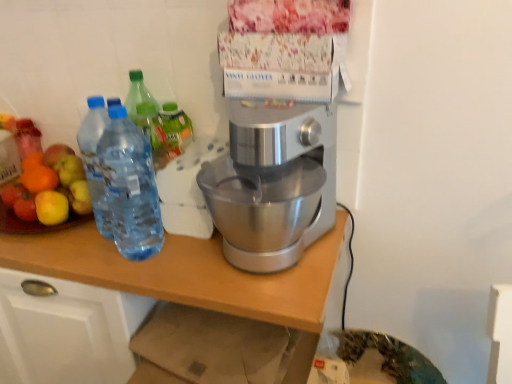
This screenshot has height=384, width=512. What do you see at coordinates (130, 187) in the screenshot?
I see `transparent plastic bottles at left` at bounding box center [130, 187].

Describe the element at coordinates (49, 187) in the screenshot. I see `shiny plastic fruit salad at left` at that location.

What is the approximate width of silver metallic table at center?

The width of silver metallic table at center is 21.30 inches.

Identify the location of transparent plastic bottles at left. The image size is (512, 384). (130, 187).

Does point (63, 191) appear closer or farther from the camera than point (136, 243)?

Clearly, point (63, 191) is more distant from the camera than point (136, 243).

Based on their positions, is shiny plastic fruit salad at left located to the left or right of transparent plastic bottles at left?

shiny plastic fruit salad at left is positioned on transparent plastic bottles at left's left side.

In the image, is shiny plastic fruit salad at left positioned in front of or behind transparent plastic bottles at left?

In the image, shiny plastic fruit salad at left appears behind transparent plastic bottles at left.

Can you confirm if shiny plastic fruit salad at left is taller than silver metallic table at center?

In fact, shiny plastic fruit salad at left may be shorter than silver metallic table at center.

Between shiny plastic fruit salad at left and silver metallic table at center, which one is positioned behind?

shiny plastic fruit salad at left.

Could you tell me if shiny plastic fruit salad at left is turned towards silver metallic table at center?

No, shiny plastic fruit salad at left does not turn towards silver metallic table at center.

Consider the image. Is transparent plastic bottles at left at the back of silver metallic stand mixer at center?

No, silver metallic stand mixer at center's orientation is not away from transparent plastic bottles at left.

Is silver metallic stand mixer at center bigger than transparent plastic bottles at left?

Yes, silver metallic stand mixer at center is bigger than transparent plastic bottles at left.

Considering the relative sizes of silver metallic stand mixer at center and transparent plastic bottles at left in the image provided, is silver metallic stand mixer at center shorter than transparent plastic bottles at left?

Yes, silver metallic stand mixer at center is shorter than transparent plastic bottles at left.

From a real-world perspective, is silver metallic stand mixer at center on top of transparent plastic bottles at left?

No, from a real-world perspective, silver metallic stand mixer at center is not above transparent plastic bottles at left.

Is silver metallic table at center positioned with its back to transparent plastic bottles at left?

No.

Looking at this image, considering the sizes of objects silver metallic table at center and transparent plastic bottles at left in the image provided, who is shorter, silver metallic table at center or transparent plastic bottles at left?

With less height is transparent plastic bottles at left.

How many degrees apart are the facing directions of silver metallic table at center and transparent plastic bottles at left?

There is a 0.347-degree angle between the facing directions of silver metallic table at center and transparent plastic bottles at left.

Is silver metallic table at center to the left or to the right of transparent plastic bottles at left in the image?

In the image, silver metallic table at center appears on the left side of transparent plastic bottles at left.

Considering the relative sizes of transparent plastic bottles at left and silver metallic stand mixer at center in the image provided, is transparent plastic bottles at left smaller than silver metallic stand mixer at center?

Indeed, transparent plastic bottles at left has a smaller size compared to silver metallic stand mixer at center.

Is transparent plastic bottles at left oriented away from silver metallic stand mixer at center?

No.

Is transparent plastic bottles at left positioned far away from silver metallic stand mixer at center?

That's not correct — transparent plastic bottles at left is a little close to silver metallic stand mixer at center.

Which is more to the right, transparent plastic bottles at left or silver metallic stand mixer at center?

silver metallic stand mixer at center.

From the image's perspective, does transparent plastic bottles at left appear lower than shiny plastic fruit salad at left?

Indeed, from the image's perspective, transparent plastic bottles at left is shown beneath shiny plastic fruit salad at left.

Is point (111, 112) closer or farther from the camera than point (46, 185)?

Clearly, point (111, 112) is closer to the camera than point (46, 185).

Would you say transparent plastic bottles at left is to the left or to the right of shiny plastic fruit salad at left in the picture?

Clearly, transparent plastic bottles at left is on the right of shiny plastic fruit salad at left in the image.

From a real-world perspective, which is physically below, transparent plastic bottles at left or shiny plastic fruit salad at left?

shiny plastic fruit salad at left.

At what (x,y) coordinates should I click in order to perform the action: click on coffee maker in front of the silver metallic table at center. Please return your answer as a coordinate pair (x, y). Looking at the image, I should click on (274, 145).

Could you tell me if silver metallic table at center is turned towards silver metallic stand mixer at center?

No.

Does silver metallic table at center come in front of silver metallic stand mixer at center?

No, the depth of silver metallic table at center is greater than that of silver metallic stand mixer at center.

Which is more to the right, silver metallic table at center or silver metallic stand mixer at center?

Positioned to the right is silver metallic stand mixer at center.

Where is `bottle on the right of the shiny plastic fruit salad at left`? The image size is (512, 384). bottle on the right of the shiny plastic fruit salad at left is located at coordinates (130, 187).

Locate an element on the screen. This screenshot has height=384, width=512. table that appears below the shiny plastic fruit salad at left (from the image's perspective) is located at coordinates (187, 273).

From the image, which object appears to be nearer to transparent plastic bottles at left, shiny plastic fruit salad at left or silver metallic table at center?

Based on the image, silver metallic table at center appears to be nearer to transparent plastic bottles at left.

Which object lies further to the anchor point shiny plastic fruit salad at left, transparent plastic bottles at left or silver metallic stand mixer at center?

silver metallic stand mixer at center is positioned further to the anchor shiny plastic fruit salad at left.

Looking at the image, which one is located further to silver metallic table at center, shiny plastic fruit salad at left or transparent plastic bottles at left?

Based on the image, shiny plastic fruit salad at left appears to be further to silver metallic table at center.

Estimate the real-world distances between objects in this image. Which object is further from transparent plastic bottles at left, silver metallic stand mixer at center or shiny plastic fruit salad at left?

Based on the image, silver metallic stand mixer at center appears to be further to transparent plastic bottles at left.

Which object lies nearer to the anchor point silver metallic table at center, transparent plastic bottles at left or shiny plastic fruit salad at left?

transparent plastic bottles at left is closer to silver metallic table at center.

Considering their positions, is silver metallic stand mixer at center positioned further to shiny plastic fruit salad at left than transparent plastic bottles at left?

Among the two, silver metallic stand mixer at center is located further to shiny plastic fruit salad at left.

Which object lies further to the anchor point transparent plastic bottles at left, silver metallic table at center or shiny plastic fruit salad at left?

Based on the image, shiny plastic fruit salad at left appears to be further to transparent plastic bottles at left.

Based on their spatial positions, is silver metallic table at center or transparent plastic bottles at left closer to silver metallic stand mixer at center?

silver metallic table at center.

The width and height of the screenshot is (512, 384). Find the location of `bottle between shiny plastic fruit salad at left and silver metallic table at center from top to bottom`. bottle between shiny plastic fruit salad at left and silver metallic table at center from top to bottom is located at coordinates point(130,187).

In order to click on table between shiny plastic fruit salad at left and silver metallic stand mixer at center in this screenshot , I will do `click(187, 273)`.

Where is `bottle between shiny plastic fruit salad at left and silver metallic stand mixer at center from left to right`? bottle between shiny plastic fruit salad at left and silver metallic stand mixer at center from left to right is located at coordinates (130, 187).

I want to click on bottle between silver metallic stand mixer at center and silver metallic table at center from top to bottom, so click(x=130, y=187).